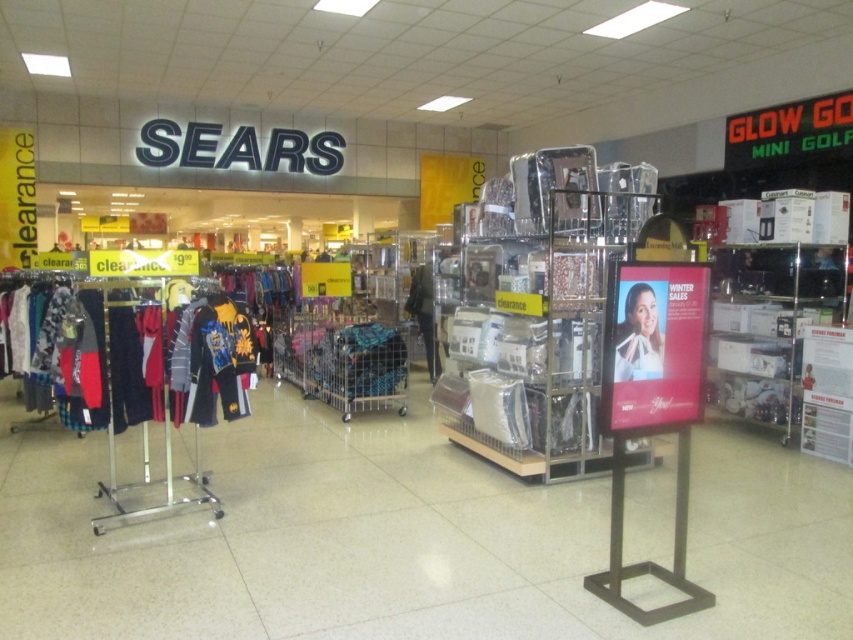
You are a customer in the Sears clearance section and see two dresses displayed at the center of the image. Which dress is closer to you, the white fabric dress at center or the black fabric dress at center?

The white fabric dress at center is closer to you because it is in front of the black fabric dress at center.

You are a customer in the Sears clearance section and want to know if the white fabric dress at center can fit into one of the clear plastic shelves at center. Can it fit based on their widths?

The clear plastic shelves at center are wider than the white fabric dress at center, so the dress can fit inside the shelves.